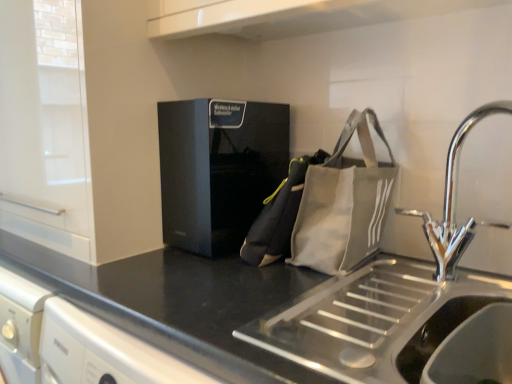
This screenshot has width=512, height=384. Describe the element at coordinates (248, 314) in the screenshot. I see `black matte countertop at center` at that location.

The width and height of the screenshot is (512, 384). Find the location of `black matte speaker at center`. black matte speaker at center is located at coordinates (218, 169).

What are the coordinates of `chrome metallic tap at right` in the screenshot? It's located at (454, 203).

This screenshot has width=512, height=384. I want to click on black matte countertop at center, so click(248, 314).

Is black matte cabinet at upper left at the left side of black matte speaker at center?

Indeed, black matte cabinet at upper left is positioned on the left side of black matte speaker at center.

Considering the sizes of objects black matte cabinet at upper left and black matte speaker at center in the image provided, who is bigger, black matte cabinet at upper left or black matte speaker at center?

black matte cabinet at upper left.

Is black matte cabinet at upper left not near black matte speaker at center?

No, black matte cabinet at upper left is not far away from black matte speaker at center.

Is black matte cabinet at upper left facing towards black matte speaker at center?

No, black matte cabinet at upper left is not turned towards black matte speaker at center.

Which of these two, black matte cabinet at upper left or stainless steel sink at lower right, is wider?

black matte cabinet at upper left is wider.

Does black matte cabinet at upper left have a larger size compared to stainless steel sink at lower right?

Yes, black matte cabinet at upper left is bigger than stainless steel sink at lower right.

Which of these two, black matte cabinet at upper left or stainless steel sink at lower right, stands shorter?

Standing shorter between the two is stainless steel sink at lower right.

Is black matte cabinet at upper left positioned with its back to stainless steel sink at lower right?

No, black matte cabinet at upper left is not facing the opposite direction of stainless steel sink at lower right.

Considering the sizes of objects gray canvas tote bag at right and black matte speaker at center in the image provided, who is bigger, gray canvas tote bag at right or black matte speaker at center?

Bigger between the two is black matte speaker at center.

Is black matte speaker at center completely or partially inside gray canvas tote bag at right?

No, black matte speaker at center is not a part of gray canvas tote bag at right.

From the image's perspective, is gray canvas tote bag at right positioned above or below black matte speaker at center?

Based on their image positions, gray canvas tote bag at right is located beneath black matte speaker at center.

Find the location of a particular element. This screenshot has width=512, height=384. home appliance behind the gray canvas tote bag at right is located at coordinates pyautogui.click(x=218, y=169).

From the picture: From the image's perspective, is canvas messenger bag at center under black matte cabinet at upper left?

Indeed, from the image's perspective, canvas messenger bag at center is shown beneath black matte cabinet at upper left.

Consider the image. From a real-world perspective, between canvas messenger bag at center and black matte cabinet at upper left, who is vertically higher?

black matte cabinet at upper left, from a real-world perspective.

Is the depth of canvas messenger bag at center less than that of black matte cabinet at upper left?

No, canvas messenger bag at center is further to the viewer.

Between black matte countertop at center and gray canvas tote bag at right, which one has smaller size?

gray canvas tote bag at right.

Is black matte countertop at center taller than gray canvas tote bag at right?

Yes.

Is black matte countertop at center spatially inside gray canvas tote bag at right, or outside of it?

The correct answer is: outside.

Which object is wider, black matte countertop at center or gray canvas tote bag at right?

black matte countertop at center is wider.

Which is in front, point (270, 197) or point (172, 317)?

The point (172, 317) is closer.

Can you see canvas messenger bag at center touching black matte countertop at center?

No, canvas messenger bag at center is not with black matte countertop at center.

Which of these two, canvas messenger bag at center or black matte countertop at center, is wider?

With larger width is black matte countertop at center.

From the image's perspective, is canvas messenger bag at center over black matte countertop at center?

Yes, from the image's perspective, canvas messenger bag at center is above black matte countertop at center.

How different are the orientations of black matte countertop at center and black matte cabinet at upper left in degrees?

They differ by 2.72 degrees in their facing directions.

Is black matte countertop at center directly adjacent to black matte cabinet at upper left?

No, black matte countertop at center is not touching black matte cabinet at upper left.

From the image's perspective, is black matte countertop at center located above or below black matte cabinet at upper left?

black matte countertop at center is situated lower than black matte cabinet at upper left in the image.

From a real-world perspective, does black matte countertop at center stand above black matte cabinet at upper left?

No.

You are a GUI agent. You are given a task and a screenshot of the screen. Output one action in this format:
    pyautogui.click(x=<x>, y=<y>)
    Task: Click on the home appliance on the right of black matte cabinet at upper left
    The width and height of the screenshot is (512, 384).
    Given the screenshot: What is the action you would take?
    pyautogui.click(x=218, y=169)

The image size is (512, 384). In order to click on sink that is in front of the black matte cabinet at upper left in this screenshot , I will do `click(437, 333)`.

From the image, which object appears to be farther from stainless steel sink at lower right, black matte cabinet at upper left or black matte countertop at center?

The object further to stainless steel sink at lower right is black matte cabinet at upper left.

Which object lies further to the anchor point canvas messenger bag at center, black matte cabinet at upper left or black matte countertop at center?

The object further to canvas messenger bag at center is black matte cabinet at upper left.

From the image, which object appears to be farther from chrome metallic tap at right, stainless steel sink at lower right or black matte countertop at center?

Among the two, black matte countertop at center is located further to chrome metallic tap at right.

Estimate the real-world distances between objects in this image. Which object is closer to chrome metallic tap at right, stainless steel sink at lower right or canvas messenger bag at center?

The object closer to chrome metallic tap at right is stainless steel sink at lower right.

When comparing their distances from gray canvas tote bag at right, does black matte speaker at center or canvas messenger bag at center seem further?

black matte speaker at center lies further to gray canvas tote bag at right than the other object.

Looking at the image, which one is located further to black matte speaker at center, chrome metallic tap at right or black matte countertop at center?

A: chrome metallic tap at right.

Looking at the image, which one is located closer to canvas messenger bag at center, chrome metallic tap at right or black matte countertop at center?

Among the two, black matte countertop at center is located nearer to canvas messenger bag at center.

Looking at the image, which one is located closer to black matte countertop at center, canvas messenger bag at center or black matte cabinet at upper left?

canvas messenger bag at center lies closer to black matte countertop at center than the other object.

In order to click on tap between gray canvas tote bag at right and stainless steel sink at lower right vertically in this screenshot , I will do click(454, 203).

At what (x,y) coordinates should I click in order to perform the action: click on home appliance between black matte cabinet at upper left and gray canvas tote bag at right. Please return your answer as a coordinate pair (x, y). The image size is (512, 384). Looking at the image, I should click on tap(218, 169).

You are a GUI agent. You are given a task and a screenshot of the screen. Output one action in this format:
    pyautogui.click(x=<x>, y=<y>)
    Task: Click on the home appliance between black matte cabinet at upper left and chrome metallic tap at right from left to right
    The image size is (512, 384).
    Given the screenshot: What is the action you would take?
    pyautogui.click(x=218, y=169)

The image size is (512, 384). Find the location of `pouch between black matte speaker at center and black matte countertop at center from top to bottom`. pouch between black matte speaker at center and black matte countertop at center from top to bottom is located at coordinates (343, 203).